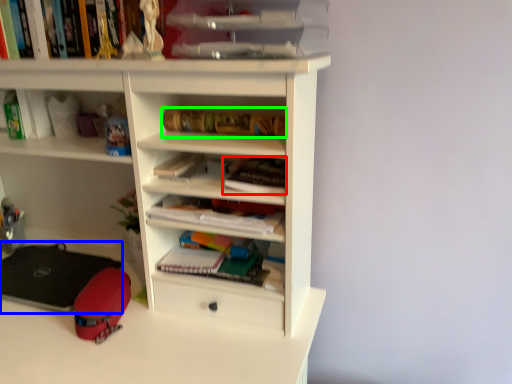
Question: Which is farther away from book (highlighted by a red box)? equipment (highlighted by a blue box) or book (highlighted by a green box)?

Choices:
 (A) equipment
 (B) book

Answer: (A)